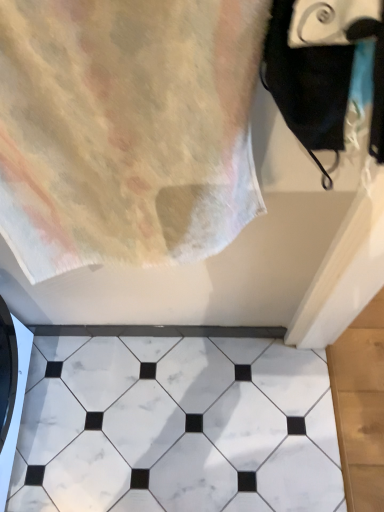
Question: Is black matte towel at upper right positioned beyond the bounds of white marble tile at center?

Choices:
 (A) no
 (B) yes

Answer: (B)

Question: Can you confirm if black matte towel at upper right is taller than white marble tile at center?

Choices:
 (A) yes
 (B) no

Answer: (A)

Question: Is black matte towel at upper right surrounding white marble tile at center?

Choices:
 (A) yes
 (B) no

Answer: (B)

Question: From the image's perspective, does black matte towel at upper right appear lower than white marble tile at center?

Choices:
 (A) no
 (B) yes

Answer: (A)

Question: Is black matte towel at upper right facing away from white marble tile at center?

Choices:
 (A) no
 (B) yes

Answer: (A)

Question: Is black matte towel at upper right not near white marble tile at center?

Choices:
 (A) yes
 (B) no

Answer: (B)

Question: Can you confirm if pastel cotton towel at upper left is thinner than white marble tile at center?

Choices:
 (A) no
 (B) yes

Answer: (B)

Question: From a real-world perspective, is pastel cotton towel at upper left under white marble tile at center?

Choices:
 (A) no
 (B) yes

Answer: (A)

Question: From the image's perspective, would you say pastel cotton towel at upper left is shown under white marble tile at center?

Choices:
 (A) no
 (B) yes

Answer: (A)

Question: Considering the relative positions of pastel cotton towel at upper left and white marble tile at center in the image provided, is pastel cotton towel at upper left to the right of white marble tile at center from the viewer's perspective?

Choices:
 (A) no
 (B) yes

Answer: (A)

Question: Could you tell me if pastel cotton towel at upper left is turned towards white marble tile at center?

Choices:
 (A) yes
 (B) no

Answer: (B)

Question: Can you confirm if pastel cotton towel at upper left is bigger than white marble tile at center?

Choices:
 (A) no
 (B) yes

Answer: (B)

Question: Can you confirm if white marble tile at center is taller than pastel cotton towel at upper left?

Choices:
 (A) yes
 (B) no

Answer: (B)